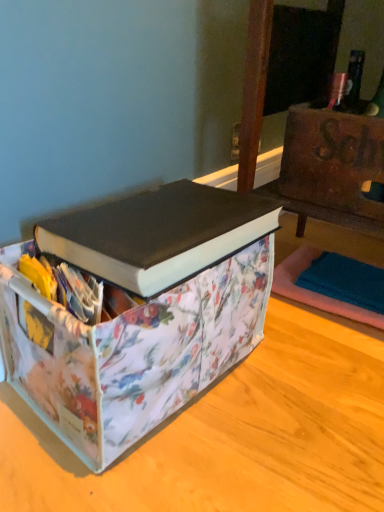
Question: In the image, is black matte book at center on the left side or the right side of floral fabric storage bin at center?

Choices:
 (A) right
 (B) left

Answer: (A)

Question: Based on their sizes in the image, would you say black matte book at center is bigger or smaller than floral fabric storage bin at center?

Choices:
 (A) small
 (B) big

Answer: (A)

Question: Considering the positions of black matte book at center and floral fabric storage bin at center in the image, is black matte book at center wider or thinner than floral fabric storage bin at center?

Choices:
 (A) thin
 (B) wide

Answer: (A)

Question: From a real-world perspective, relative to black matte book at center, is floral fabric storage bin at center vertically above or below?

Choices:
 (A) above
 (B) below

Answer: (B)

Question: From the image's perspective, is floral fabric storage bin at center positioned above or below black matte book at center?

Choices:
 (A) above
 (B) below

Answer: (B)

Question: Is floral fabric storage bin at center bigger or smaller than black matte book at center?

Choices:
 (A) big
 (B) small

Answer: (A)

Question: Is floral fabric storage bin at center in front of or behind black matte book at center in the image?

Choices:
 (A) front
 (B) behind

Answer: (A)